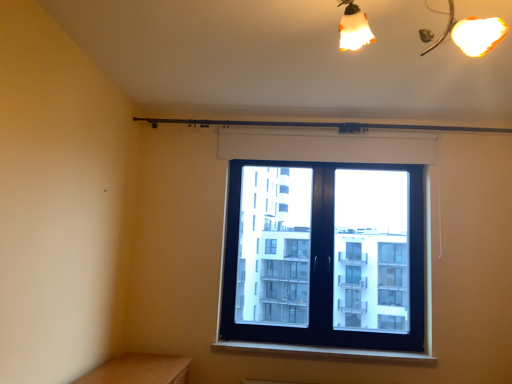
Find the location of `free space underneath black plastic window at center (from a real-world perspective)`. free space underneath black plastic window at center (from a real-world perspective) is located at coordinates (324, 347).